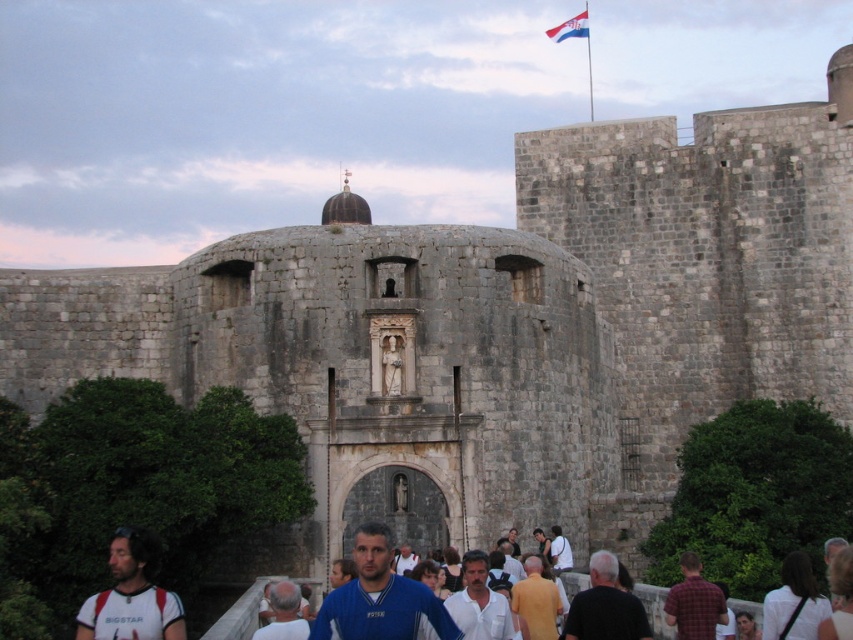
Question: Which is nearer to the yellow cotton shirt at center?

Choices:
 (A) black matte shirt at center
 (B) polished fabric flag at upper center
 (C) white fabric at lower right
 (D) white fabric shirt at lower left

Answer: (A)

Question: Can you confirm if white fabric shirt at lower left is wider than yellow cotton shirt at center?

Choices:
 (A) yes
 (B) no

Answer: (A)

Question: Does black matte shirt at center appear over yellow cotton shirt at center?

Choices:
 (A) yes
 (B) no

Answer: (B)

Question: Based on their relative distances, which object is nearer to the white fabric shirt at lower left?

Choices:
 (A) polished fabric flag at upper center
 (B) plaid shirt at lower right

Answer: (B)

Question: Estimate the real-world distances between objects in this image. Which object is farther from the plaid shirt at lower right?

Choices:
 (A) white fabric at lower right
 (B) white fabric shirt at lower left
 (C) yellow cotton shirt at center

Answer: (B)

Question: Is plaid shirt at lower right below polished fabric flag at upper center?

Choices:
 (A) no
 (B) yes

Answer: (B)